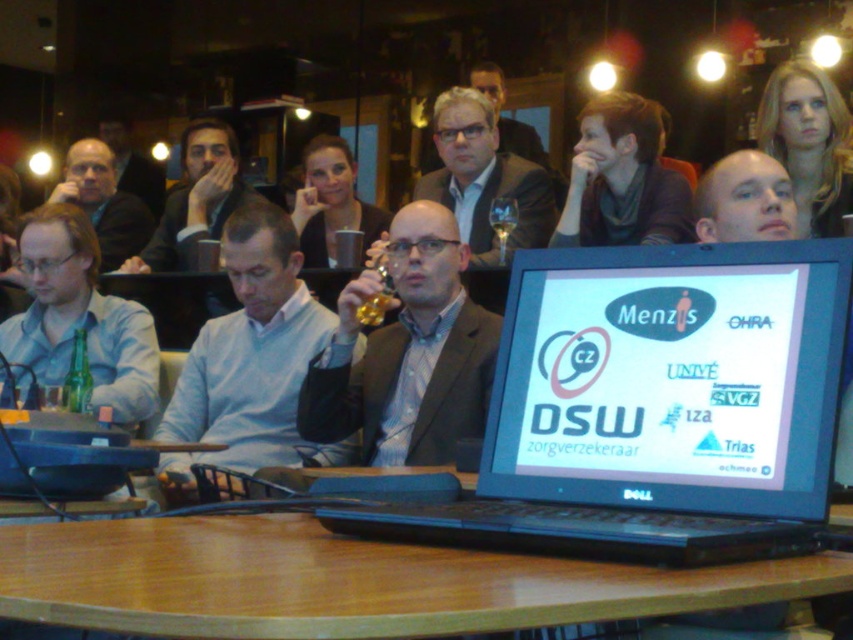
Question: Does light gray sweater at center appear on the left side of smooth skin face at center?

Choices:
 (A) no
 (B) yes

Answer: (B)

Question: Which object is farther from the camera taking this photo?

Choices:
 (A) light gray sweater at center
 (B) smooth skin face at center

Answer: (A)

Question: Which point is farther from the camera taking this photo?

Choices:
 (A) (560, 406)
 (B) (135, 156)
 (C) (474, 346)
 (D) (141, 248)

Answer: (B)

Question: Which object appears closest to the camera in this image?

Choices:
 (A) matte blue shirt at left
 (B) green glass bottle at lower left

Answer: (B)

Question: From the image, what is the correct spatial relationship of wooden table at center in relation to matte black jacket at upper center?

Choices:
 (A) right
 (B) left

Answer: (A)

Question: Is dark gray scarf at upper center bigger than matte gray shirt at upper center?

Choices:
 (A) no
 (B) yes

Answer: (A)